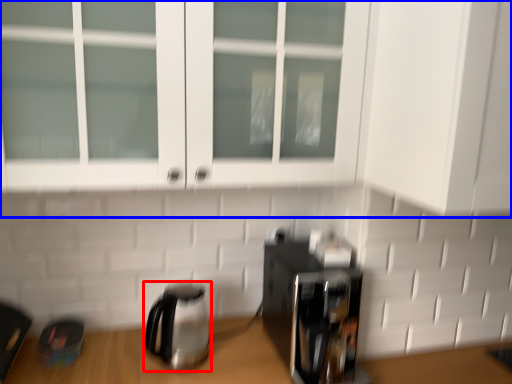
Question: Which of the following is the closest to the observer, kettle (highlighted by a red box) or cabinetry (highlighted by a blue box)?

Choices:
 (A) kettle
 (B) cabinetry

Answer: (B)